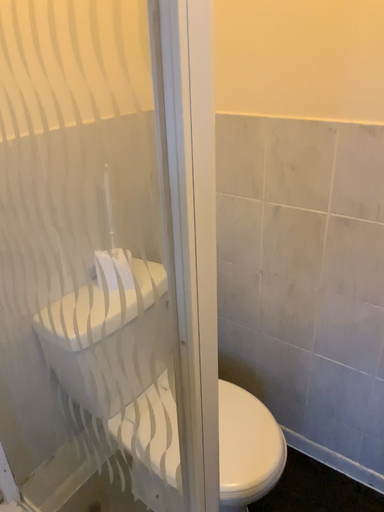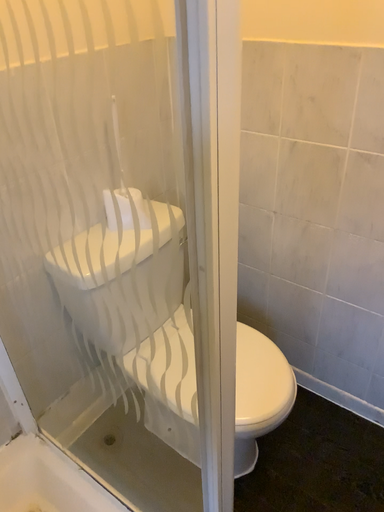
Question: Which way did the camera rotate in the video?

Choices:
 (A) rotated upward
 (B) rotated downward

Answer: (B)